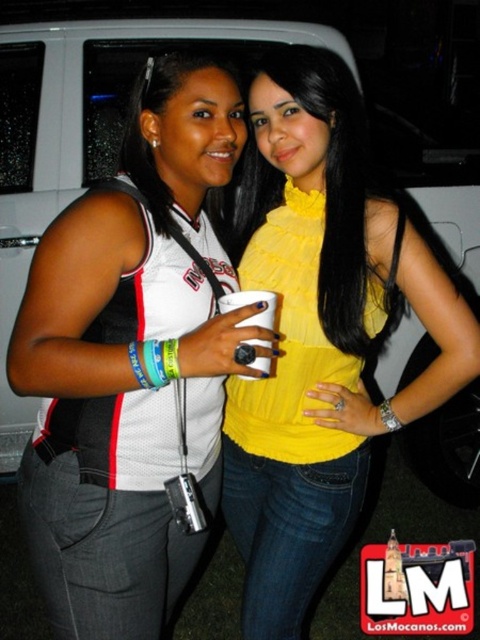
You are taking a photo of two people standing in front of you. You notice two points in the image at coordinates point [148,602] and point [265,326]. Which point is closer to the camera?

Point [148,602] is further to the camera than point [265,326], so the closer point to the camera is point [265,326].

You are standing at the location of the viewer in the image and want to hand a small gift to the person wearing the yellow satin blouse at center without moving closer. Can you reach them with your arm extended? Assume your arm can reach 3.5 feet when extended.

The yellow satin blouse at center and viewer are 4.00 feet apart from each other, which is farther than your 3.5 feet reach. You cannot reach them without moving closer.

You are organizing a small party and have two items at the center of the table. The white jersey at center and the white paper cup at center. You need to place a decorative ribbon around the wider item. Which item should you choose?

The white jersey at center is wider than the white paper cup at center, so you should place the decorative ribbon around the white jersey at center.